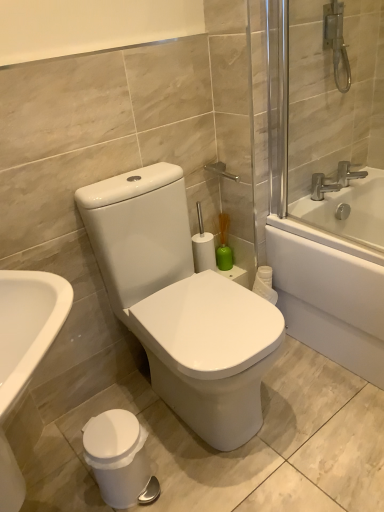
Question: Is silver metallic faucet at upper right, the first tap from the left, shorter than white plastic trash can at lower left?

Choices:
 (A) yes
 (B) no

Answer: (A)

Question: Is white plastic trash can at lower left inside silver metallic faucet at upper right, marked as the 2th tap in a right-to-left arrangement?

Choices:
 (A) yes
 (B) no

Answer: (B)

Question: Does silver metallic faucet at upper right, marked as the 2th tap in a right-to-left arrangement, appear on the right side of white plastic trash can at lower left?

Choices:
 (A) yes
 (B) no

Answer: (A)

Question: Considering the relative positions of silver metallic faucet at upper right, the first tap from the left, and white plastic trash can at lower left in the image provided, is silver metallic faucet at upper right, the first tap from the left, behind white plastic trash can at lower left?

Choices:
 (A) yes
 (B) no

Answer: (A)

Question: Could you tell me if silver metallic faucet at upper right, the first tap from the left, is turned towards white plastic trash can at lower left?

Choices:
 (A) no
 (B) yes

Answer: (A)

Question: Considering the relative sizes of silver metallic faucet at upper right, the first tap from the left, and white plastic trash can at lower left in the image provided, is silver metallic faucet at upper right, the first tap from the left, smaller than white plastic trash can at lower left?

Choices:
 (A) yes
 (B) no

Answer: (A)

Question: Does white glossy toilet at center have a lesser height compared to white plastic trash can at lower left?

Choices:
 (A) no
 (B) yes

Answer: (A)

Question: Is white glossy toilet at center positioned far away from white plastic trash can at lower left?

Choices:
 (A) yes
 (B) no

Answer: (B)

Question: Does white glossy toilet at center come behind white plastic trash can at lower left?

Choices:
 (A) yes
 (B) no

Answer: (B)

Question: Can you confirm if white glossy toilet at center is positioned to the right of white plastic trash can at lower left?

Choices:
 (A) no
 (B) yes

Answer: (B)

Question: Is white plastic trash can at lower left completely or partially inside white glossy toilet at center?

Choices:
 (A) no
 (B) yes

Answer: (A)

Question: Is white glossy toilet at center positioned with its back to white plastic trash can at lower left?

Choices:
 (A) yes
 (B) no

Answer: (B)

Question: Is white glossy bathtub at upper right to the right of white glossy toilet at center from the viewer's perspective?

Choices:
 (A) yes
 (B) no

Answer: (A)